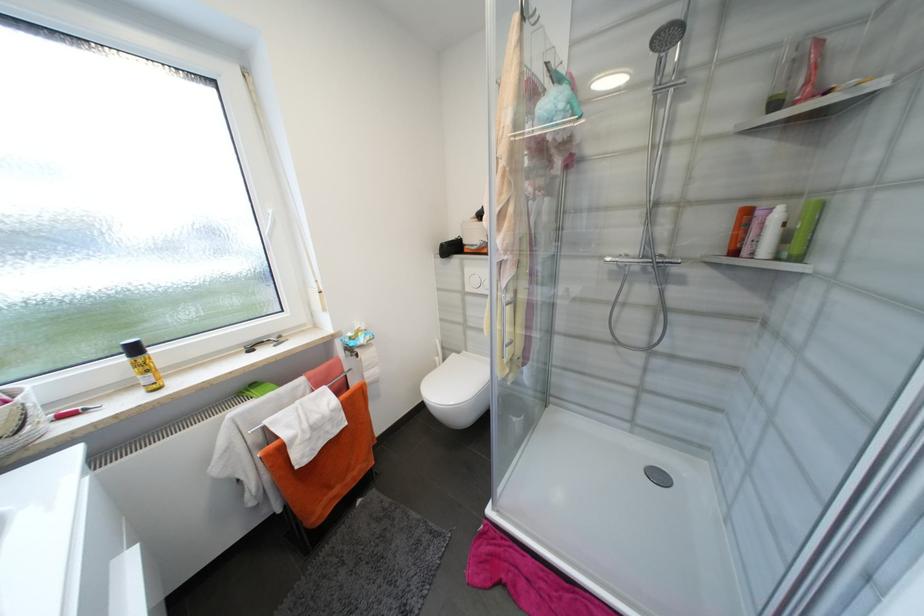
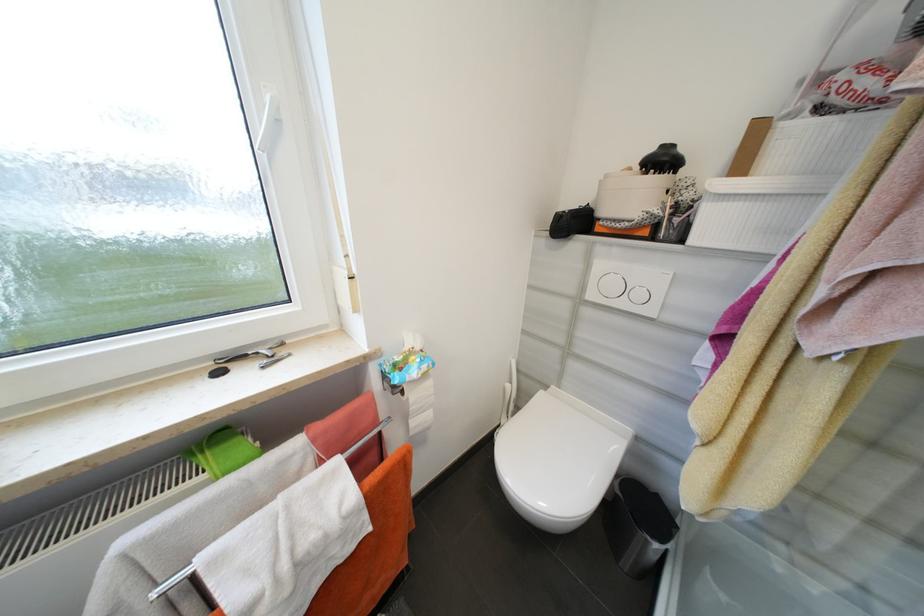
Locate, in the second image, the point that corresponds to point 465,354 in the first image.

(552, 387)